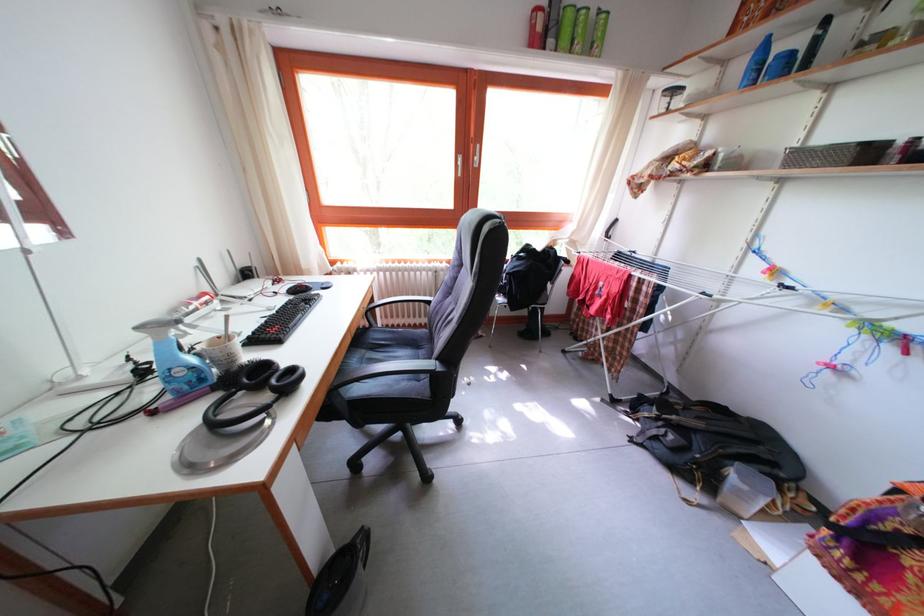
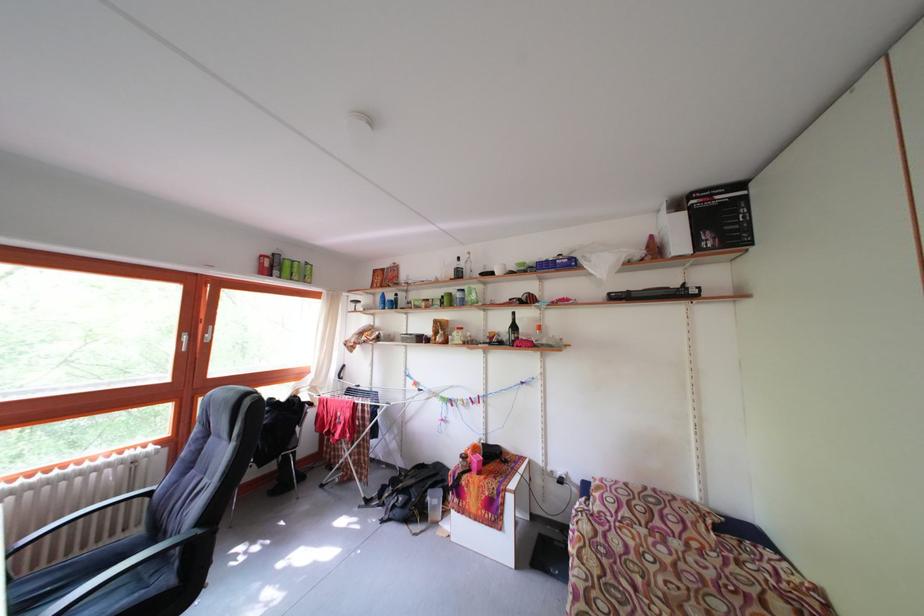
How did the camera likely rotate?

The camera's rotation is toward right-up.